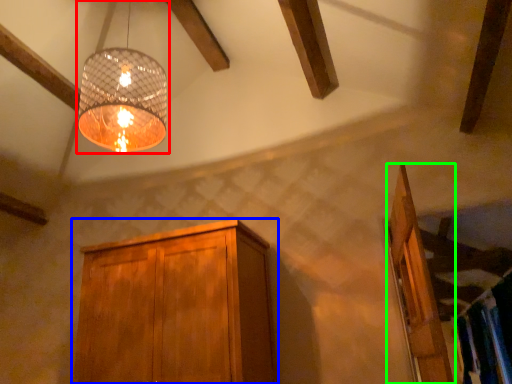
Question: Based on their relative distances, which object is farther from lamp (highlighted by a red box)? Choose from cabinetry (highlighted by a blue box) and door (highlighted by a green box).

Choices:
 (A) cabinetry
 (B) door

Answer: (B)